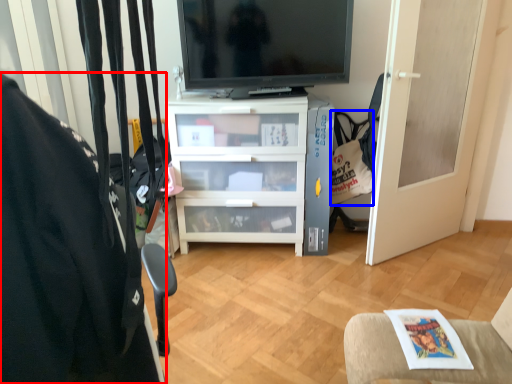
Question: Which point is further to the camera, furniture (highlighted by a red box) or handbag (highlighted by a blue box)?

Choices:
 (A) furniture
 (B) handbag

Answer: (B)